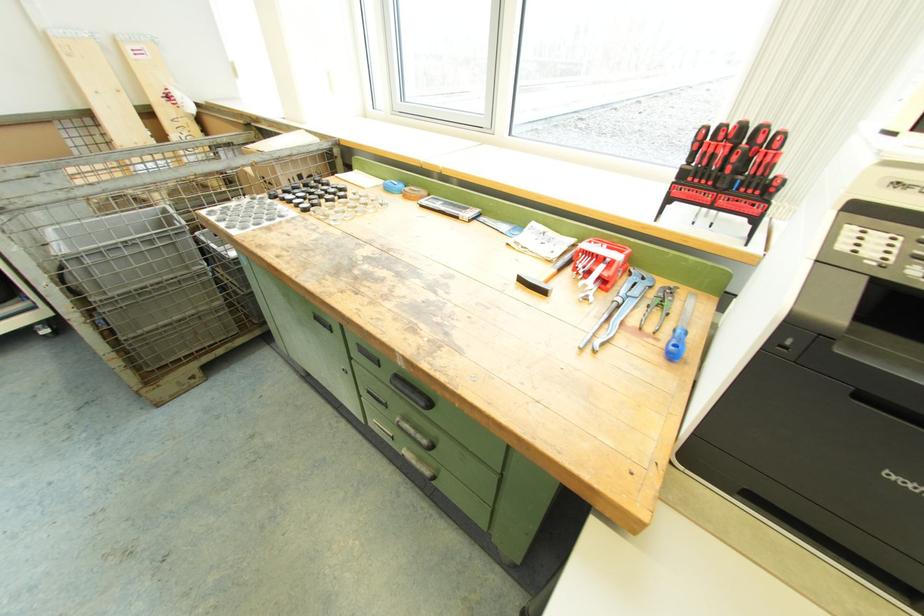
Find where to strik the small hammer. Please return your answer as a coordinate pair (x, y).

(679, 331)